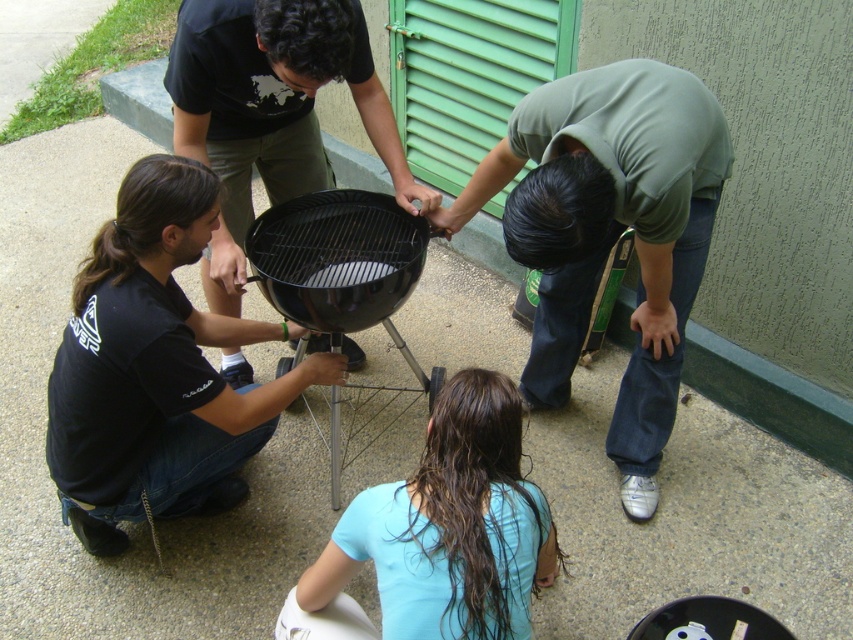
Question: Which of these objects is positioned farthest from the black matte barbecue grill at center?

Choices:
 (A) green matte shirt at center
 (B) light blue fabric at lower center
 (C) black matte grill at lower left
 (D) matte black grill at center

Answer: (B)

Question: Among these points, which one is farthest from the camera?

Choices:
 (A) (323, 275)
 (B) (166, 497)
 (C) (250, 372)

Answer: (C)

Question: Is black matte grill at lower left further to camera compared to black matte barbecue grill at center?

Choices:
 (A) no
 (B) yes

Answer: (A)

Question: Estimate the real-world distances between objects in this image. Which object is closer to the light blue fabric at lower center?

Choices:
 (A) black matte barbecue grill at center
 (B) green matte shirt at center

Answer: (B)

Question: Is green matte shirt at center to the left of black matte grill at lower left from the viewer's perspective?

Choices:
 (A) yes
 (B) no

Answer: (B)

Question: Considering the relative positions of green matte shirt at center and black matte barbecue grill at center in the image provided, where is green matte shirt at center located with respect to black matte barbecue grill at center?

Choices:
 (A) above
 (B) below

Answer: (A)